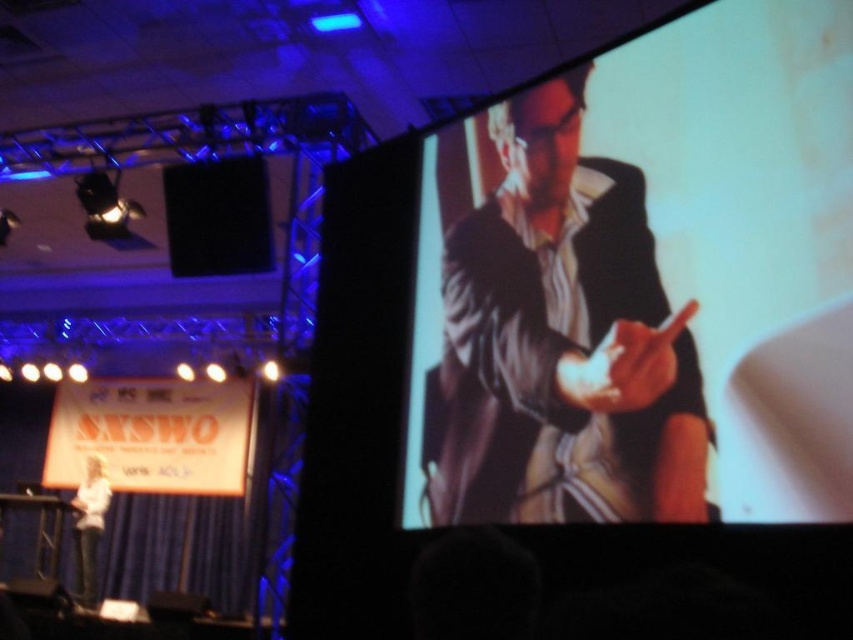
Is point (646, 300) closer to camera compared to point (120, 401)?

Yes, it is.

Identify the location of matte black suit at center. (556, 337).

In order to click on matte black suit at center in this screenshot , I will do `click(556, 337)`.

Who is more distant from viewer, (221,472) or (267,256)?

The point (221,472) is behind.

Between white paper at lower left and black matte speaker at upper left, which one has less height?

Standing shorter between the two is black matte speaker at upper left.

Which is behind, point (51, 468) or point (227, 172)?

Point (51, 468)

Locate an element on the screen. Image resolution: width=853 pixels, height=640 pixels. white paper at lower left is located at coordinates (152, 435).

Is matte black suit at center bigger than black matte speaker at upper left?

Indeed, matte black suit at center has a larger size compared to black matte speaker at upper left.

Does matte black suit at center come behind black matte speaker at upper left?

No, matte black suit at center is in front of black matte speaker at upper left.

This screenshot has height=640, width=853. I want to click on matte black suit at center, so click(x=556, y=337).